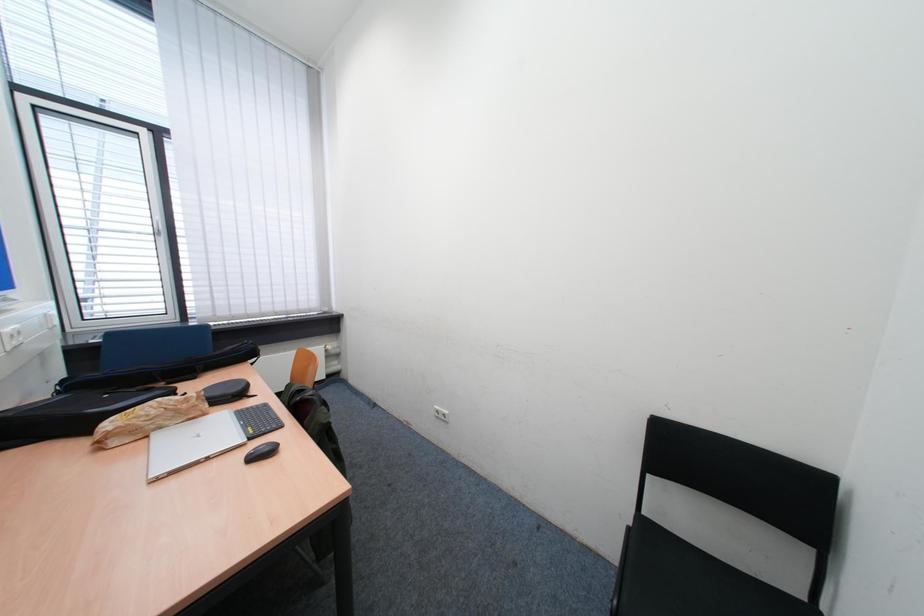
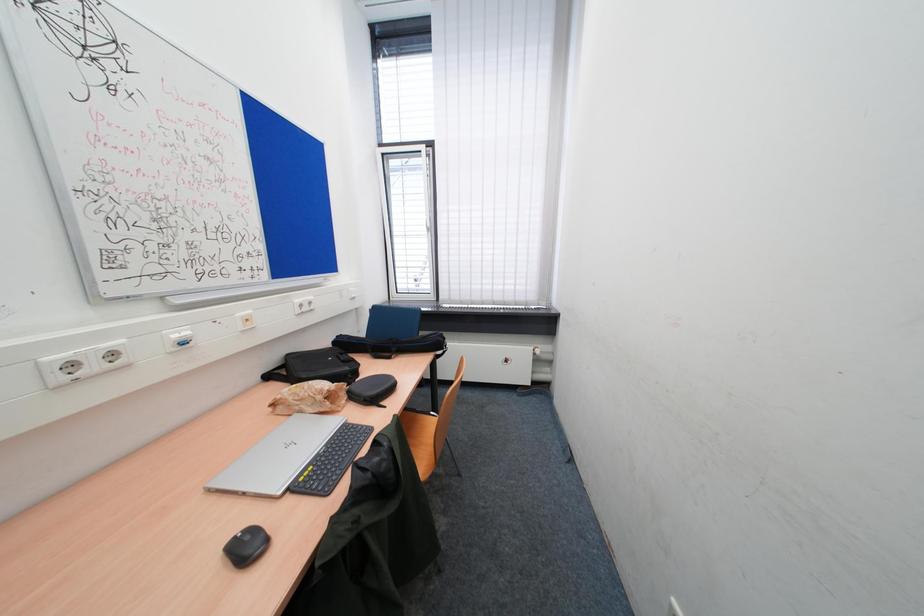
Question: The camera is either moving clockwise (left) or counter-clockwise (right) around the object. The first image is from the beginning of the video and the second image is from the end. Is the camera moving left or right when shooting the video?

Choices:
 (A) Left
 (B) Right

Answer: (B)